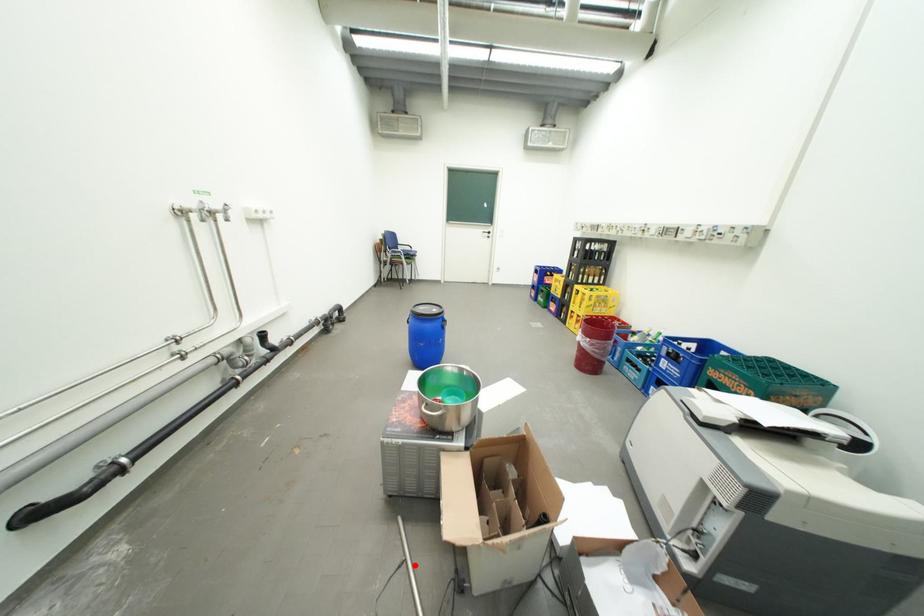
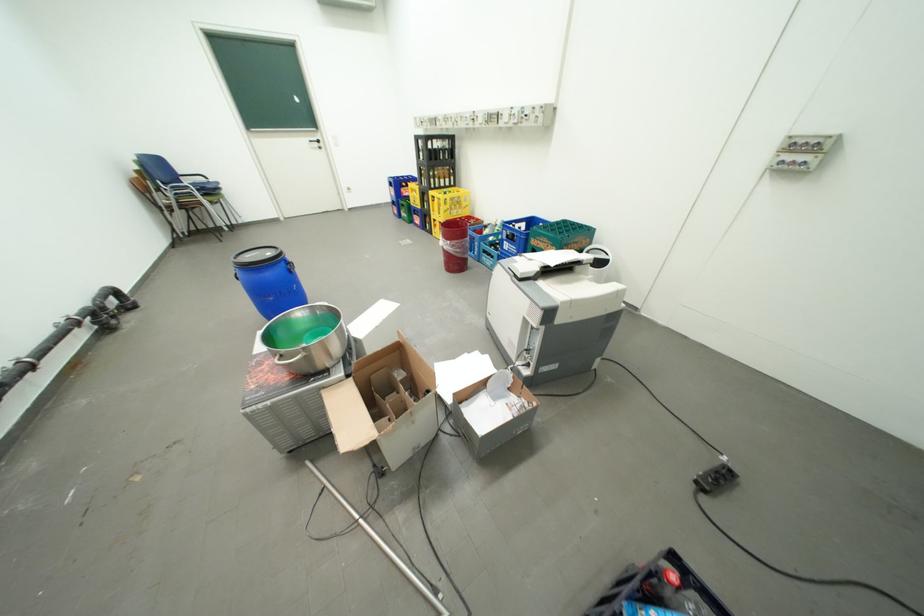
Question: A red point is marked in image1. In image2, is the corresponding 3D point closer to the camera or farther? Reply with the corresponding letter.

Choices:
 (A) The corresponding 3D point is closer.
 (B) The corresponding 3D point is farther.

Answer: (B)